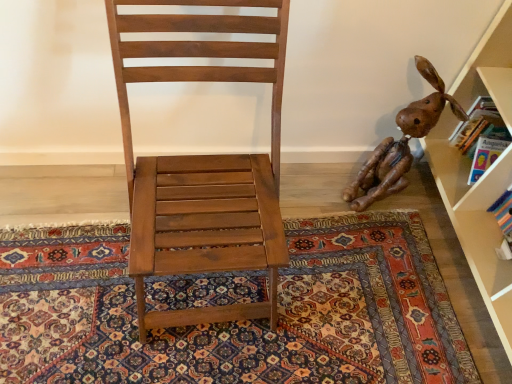
Question: Is carpeted floor at center to the right of matte wood chair at center from the viewer's perspective?

Choices:
 (A) yes
 (B) no

Answer: (A)

Question: From a real-world perspective, is carpeted floor at center over matte wood chair at center?

Choices:
 (A) yes
 (B) no

Answer: (B)

Question: Is carpeted floor at center taller than matte wood chair at center?

Choices:
 (A) yes
 (B) no

Answer: (B)

Question: From the image's perspective, does carpeted floor at center appear higher than matte wood chair at center?

Choices:
 (A) no
 (B) yes

Answer: (A)

Question: Does carpeted floor at center contain matte wood chair at center?

Choices:
 (A) no
 (B) yes

Answer: (A)

Question: Considering the relative sizes of carpeted floor at center and matte wood chair at center in the image provided, is carpeted floor at center smaller than matte wood chair at center?

Choices:
 (A) yes
 (B) no

Answer: (A)

Question: Is brown leather dog at right positioned with its back to matte wood chair at center?

Choices:
 (A) no
 (B) yes

Answer: (A)

Question: Can you confirm if brown leather dog at right is positioned to the left of matte wood chair at center?

Choices:
 (A) yes
 (B) no

Answer: (B)

Question: From a real-world perspective, is brown leather dog at right positioned over matte wood chair at center based on gravity?

Choices:
 (A) yes
 (B) no

Answer: (B)

Question: Is brown leather dog at right placed right next to matte wood chair at center?

Choices:
 (A) no
 (B) yes

Answer: (A)

Question: Can you confirm if brown leather dog at right is bigger than matte wood chair at center?

Choices:
 (A) no
 (B) yes

Answer: (A)

Question: From the image's perspective, is brown leather dog at right below matte wood chair at center?

Choices:
 (A) yes
 (B) no

Answer: (B)

Question: Is matte wood chair at center facing away from brown leather dog at right?

Choices:
 (A) no
 (B) yes

Answer: (A)